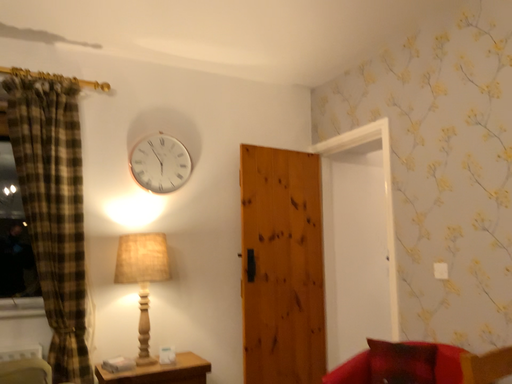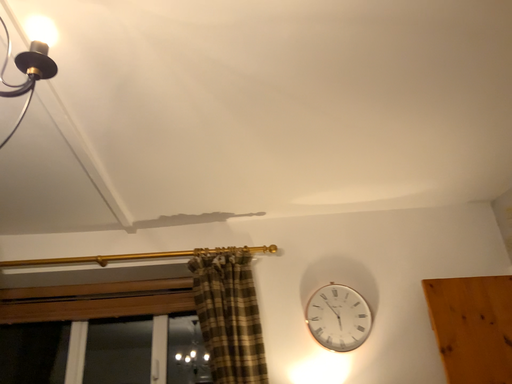
Question: How did the camera likely rotate when shooting the video?

Choices:
 (A) rotated downward
 (B) rotated upward

Answer: (B)